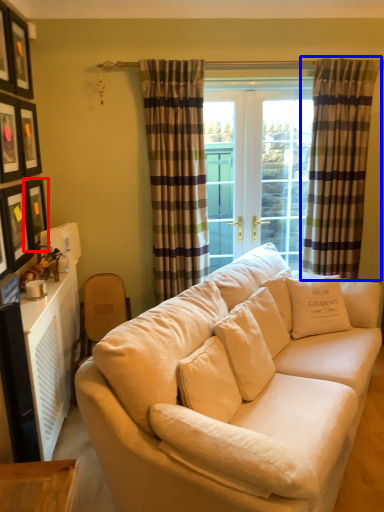
Question: Among these objects, which one is farthest to the camera, picture frame (highlighted by a red box) or curtain (highlighted by a blue box)?

Choices:
 (A) picture frame
 (B) curtain

Answer: (B)